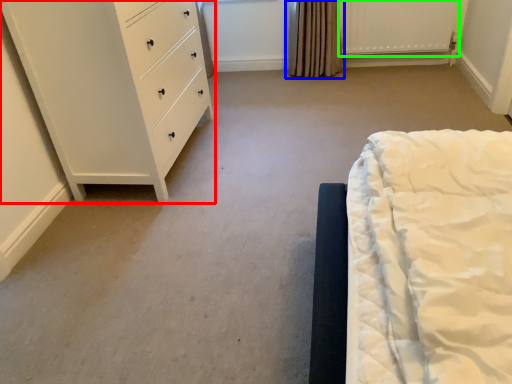
Question: Which object is the closest to the chest of drawers (highlighted by a red box)? Choose among these: curtain (highlighted by a blue box) or radiator (highlighted by a green box).

Choices:
 (A) curtain
 (B) radiator

Answer: (A)